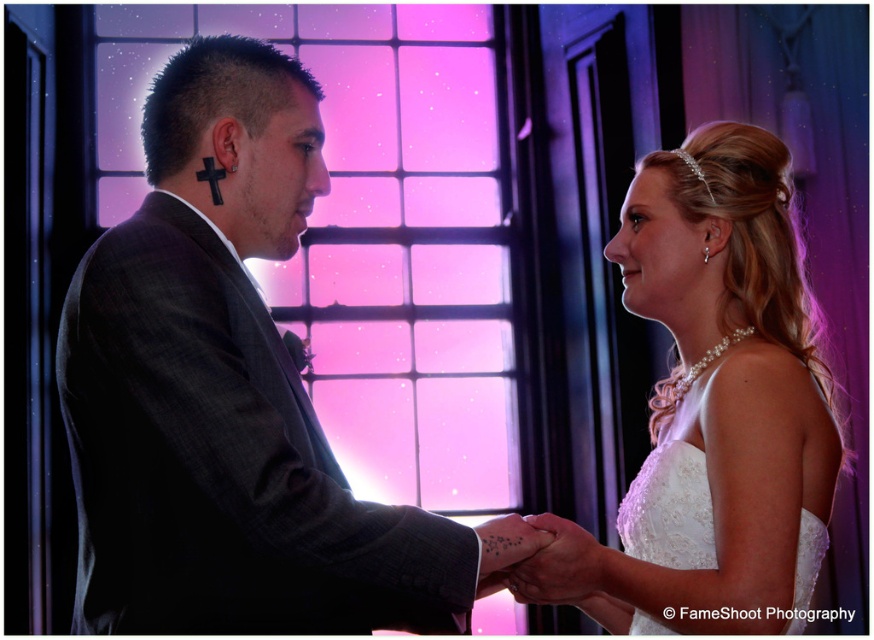
Does white lace dress at right appear on the left side of white lace wedding dress at right?

Incorrect, white lace dress at right is not on the left side of white lace wedding dress at right.

What do you see at coordinates (712, 403) in the screenshot? I see `white lace dress at right` at bounding box center [712, 403].

Locate an element on the screen. This screenshot has height=640, width=874. white lace dress at right is located at coordinates (712, 403).

Can you confirm if matte black suit at left is positioned above white lace dress at right?

Correct, matte black suit at left is located above white lace dress at right.

Can you confirm if matte black suit at left is taller than white lace dress at right?

Indeed, matte black suit at left has a greater height compared to white lace dress at right.

Locate an element on the screen. The height and width of the screenshot is (640, 874). matte black suit at left is located at coordinates (232, 396).

Does matte black suit at left have a greater height compared to matte black hand at center?

Yes.

Which is behind, point (300, 461) or point (525, 573)?

Positioned behind is point (525, 573).

Identify the location of matte black suit at left. click(232, 396).